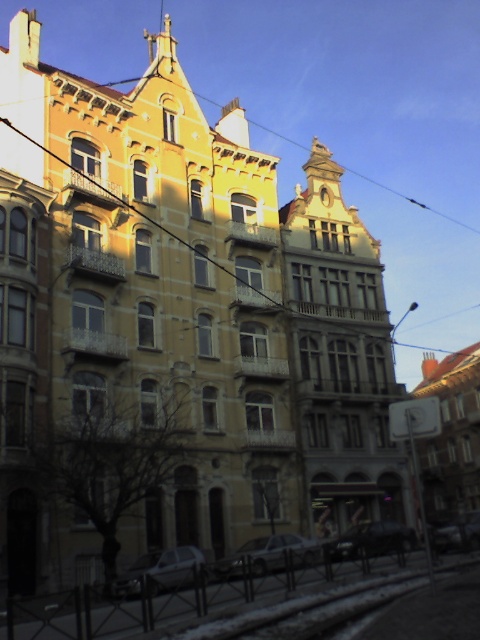
Question: Can you confirm if silver metallic car at center is positioned to the right of yellow matte clock at upper center?

Choices:
 (A) yes
 (B) no

Answer: (B)

Question: Estimate the real-world distances between objects in this image. Which object is closer to the silver metallic car at lower center?

Choices:
 (A) shiny black car at lower center
 (B) yellow matte clock at upper center

Answer: (A)

Question: Which point is farther to the camera?

Choices:
 (A) yellow matte clock at upper center
 (B) silver metallic car at center

Answer: (A)

Question: Which point is farther to the camera?

Choices:
 (A) (194, 547)
 (B) (369, 529)

Answer: (B)

Question: Does silver metallic car at center have a smaller size compared to silver metallic car at lower center?

Choices:
 (A) yes
 (B) no

Answer: (B)

Question: Is silver metallic car at center to the left of silver metallic car at lower center from the viewer's perspective?

Choices:
 (A) no
 (B) yes

Answer: (A)